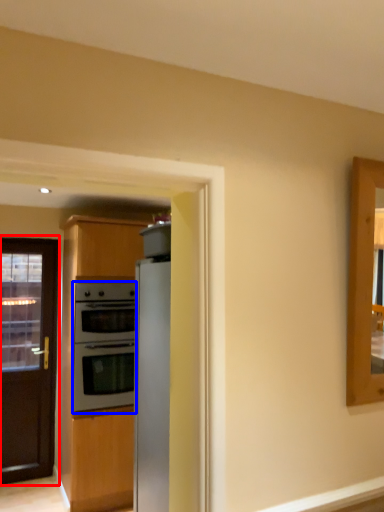
Question: Which point is further to the camera, door (highlighted by a red box) or oven (highlighted by a blue box)?

Choices:
 (A) door
 (B) oven

Answer: (A)